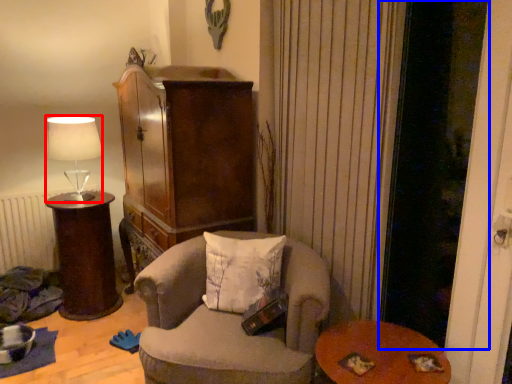
Question: Which object is closer to the camera taking this photo, lamp (highlighted by a red box) or screen door (highlighted by a blue box)?

Choices:
 (A) lamp
 (B) screen door

Answer: (B)